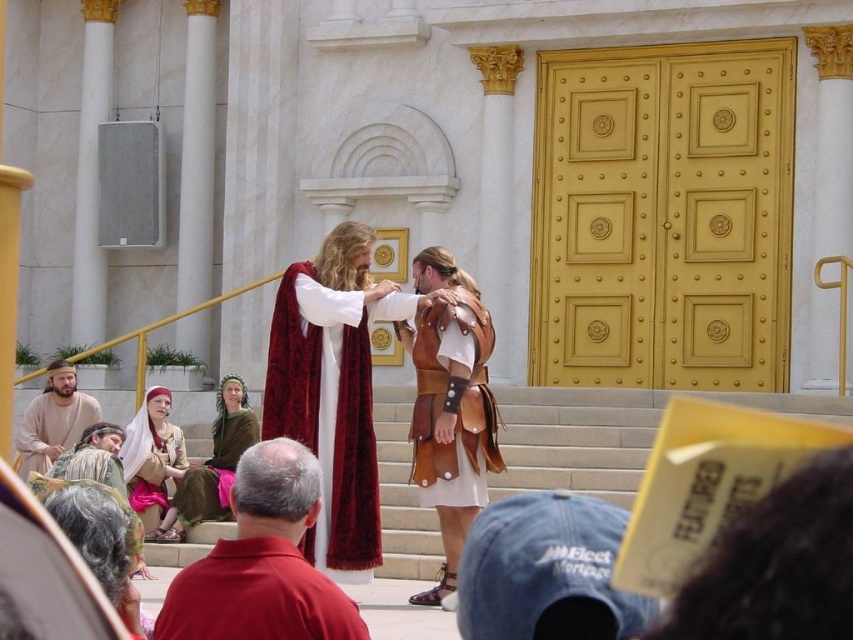
Question: Is beige fabric robe at lower left above velvet-like red robe at lower left?

Choices:
 (A) yes
 (B) no

Answer: (A)

Question: Is red leather sandals at lower center above white fabric headscarf at lower left?

Choices:
 (A) no
 (B) yes

Answer: (A)

Question: Based on their relative distances, which object is nearer to the brown leather robe at center?

Choices:
 (A) green fabric dress at center
 (B) red leather sandals at lower center
 (C) beige fabric robe at lower left
 (D) brown leather armor at center

Answer: (A)

Question: Which point is farther from the camera taking this photo?

Choices:
 (A) (434, 438)
 (B) (248, 406)
 (C) (80, 451)
 (D) (68, 449)

Answer: (B)

Question: Which of these objects is positioned closest to the green fabric dress at center?

Choices:
 (A) velvet red robe at center
 (B) denim baseball cap at lower center
 (C) beige fabric robe at lower left

Answer: (C)

Question: Can you confirm if red leather sandals at lower center is positioned to the left of white fabric headscarf at lower left?

Choices:
 (A) no
 (B) yes

Answer: (A)